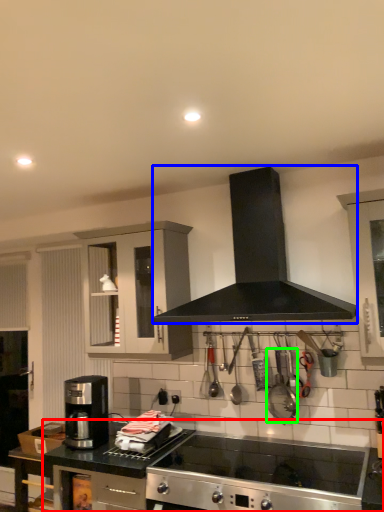
Question: Which object is positioned closest to countertop (highlighted by a red box)? Select from kitchen appliance (highlighted by a blue box) and appliance (highlighted by a green box).

Choices:
 (A) kitchen appliance
 (B) appliance

Answer: (B)